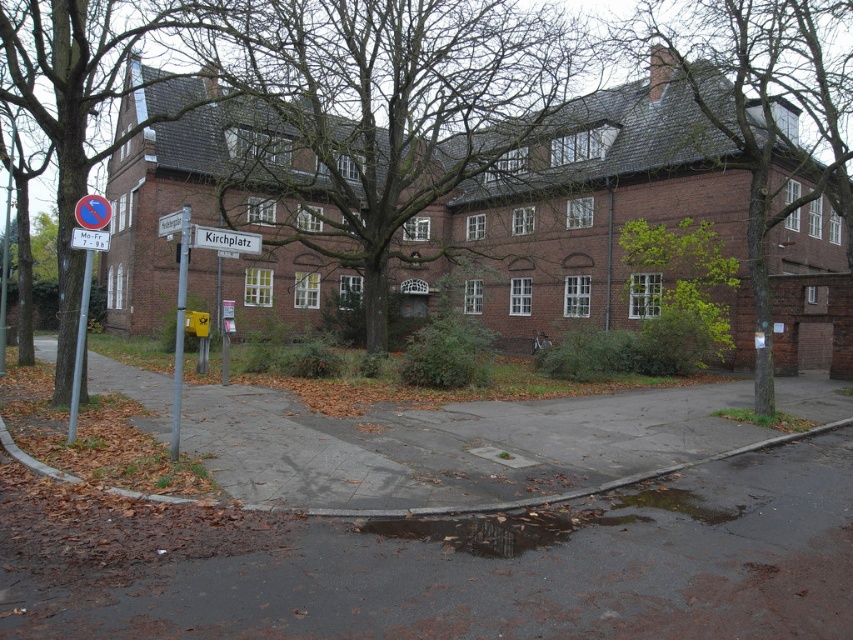
You are a pedestrian standing at the street corner looking towards the large brick building. You notice a green leafy tree at upper right and a white plastic sign at upper left. Which object is located higher in the image?

The green leafy tree at upper right is positioned over the white plastic sign at upper left, so it is higher in the image.

You are a pedestrian standing on the paved road near the green leafy tree at center and the blue plastic sign at upper left. Which object is wider from your perspective?

The green leafy tree at center is wider than the blue plastic sign at upper left.